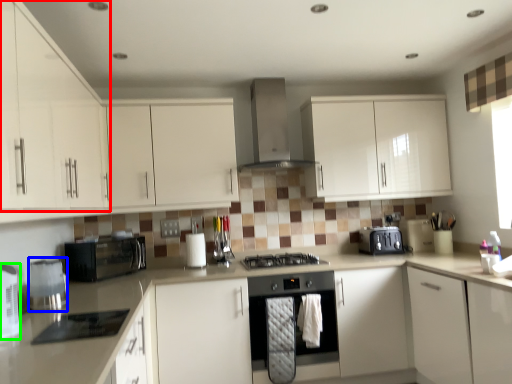
Question: Which object is the farthest from cabinetry (highlighted by a red box)? Choose among these: kitchen appliance (highlighted by a blue box) or appliance (highlighted by a green box).

Choices:
 (A) kitchen appliance
 (B) appliance

Answer: (B)